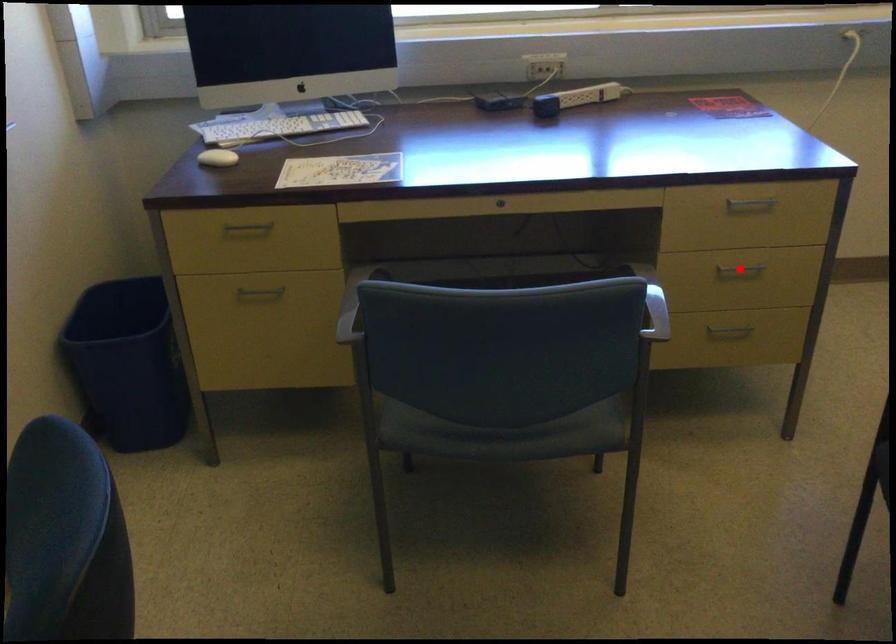
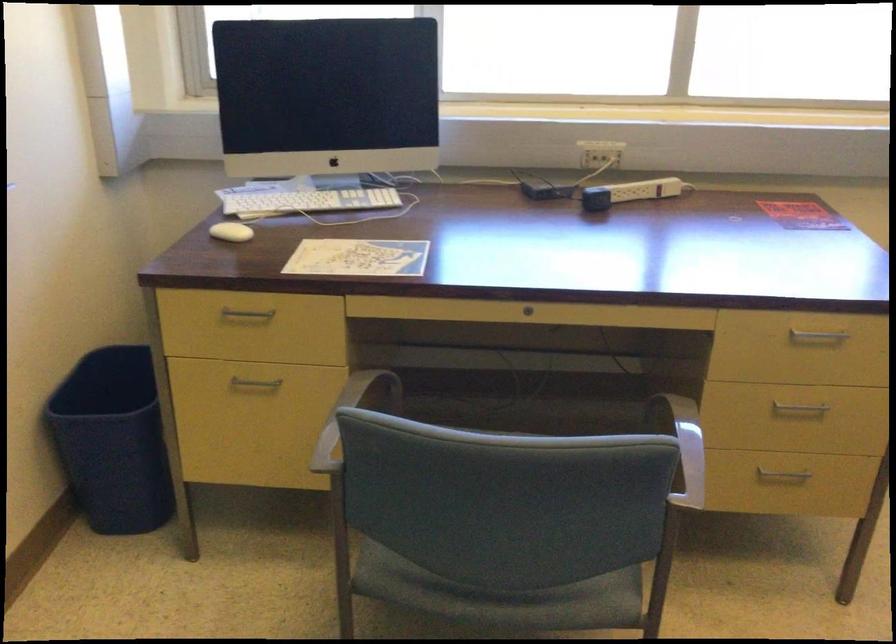
Where in the second image is the point corresponding to the highlighted location from the first image?

(798, 408)